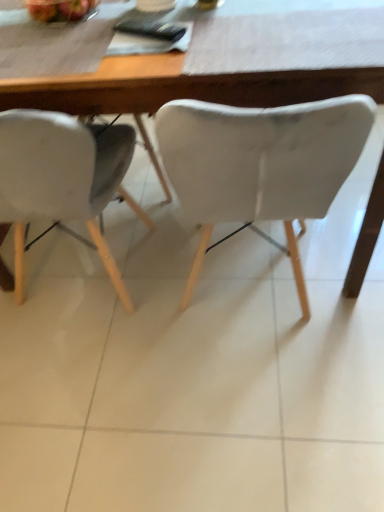
Question: From the image's perspective, relative to white matte chair at center, the first chair viewed from the right, is shiny red apple at upper left above or below?

Choices:
 (A) below
 (B) above

Answer: (B)

Question: Does point pyautogui.click(x=48, y=3) appear closer or farther from the camera than point pyautogui.click(x=223, y=108)?

Choices:
 (A) farther
 (B) closer

Answer: (A)

Question: Based on their relative distances, which object is farther from the shiny red apple at upper left?

Choices:
 (A) white matte chair at left, marked as the 1th chair in a left-to-right arrangement
 (B) wooden table at center
 (C) white matte chair at center, the first chair viewed from the right

Answer: (C)

Question: Based on their relative distances, which object is nearer to the white matte chair at left, arranged as the 2th chair when viewed from the right?

Choices:
 (A) white matte chair at center, the second chair when ordered from left to right
 (B) shiny red apple at upper left
 (C) wooden table at center

Answer: (C)